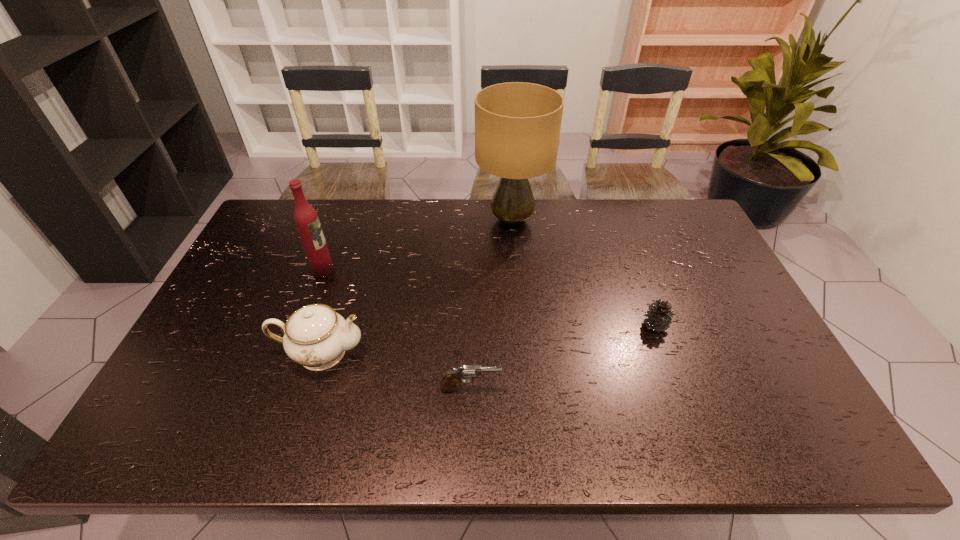
I want to click on the farthest object, so click(x=517, y=125).

Image resolution: width=960 pixels, height=540 pixels. I want to click on the tallest object, so click(517, 125).

You are a GUI agent. You are given a task and a screenshot of the screen. Output one action in this format:
    pyautogui.click(x=<x>, y=<y>)
    Task: Click on the liquor
    The width and height of the screenshot is (960, 540).
    Given the screenshot: What is the action you would take?
    pyautogui.click(x=306, y=219)

In order to click on the second farthest object in this screenshot , I will do `click(306, 219)`.

You are a GUI agent. You are given a task and a screenshot of the screen. Output one action in this format:
    pyautogui.click(x=<x>, y=<y>)
    Task: Click on the third tallest object
    
    Given the screenshot: What is the action you would take?
    pyautogui.click(x=316, y=336)

You are a GUI agent. You are given a task and a screenshot of the screen. Output one action in this format:
    pyautogui.click(x=<x>, y=<y>)
    Task: Click on the pistol
    This screenshot has width=960, height=540.
    Given the screenshot: What is the action you would take?
    pyautogui.click(x=448, y=383)

Locate an element on the screen. The image size is (960, 540). the rightmost object is located at coordinates (659, 316).

Where is `vacant space located 0.060m on the front of the farthest object`? This screenshot has height=540, width=960. vacant space located 0.060m on the front of the farthest object is located at coordinates (515, 255).

You are a GUI agent. You are given a task and a screenshot of the screen. Output one action in this format:
    pyautogui.click(x=<x>, y=<y>)
    Task: Click on the free location located 0.280m on the label of the second farthest object
    Image resolution: width=960 pixels, height=540 pixels.
    Given the screenshot: What is the action you would take?
    pyautogui.click(x=423, y=270)

Where is `free space located at the spout of the third tallest object`? free space located at the spout of the third tallest object is located at coordinates pyautogui.click(x=486, y=353).